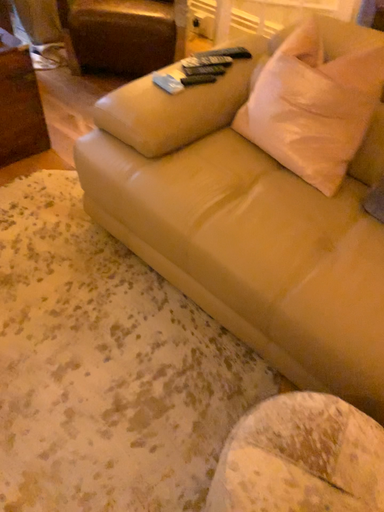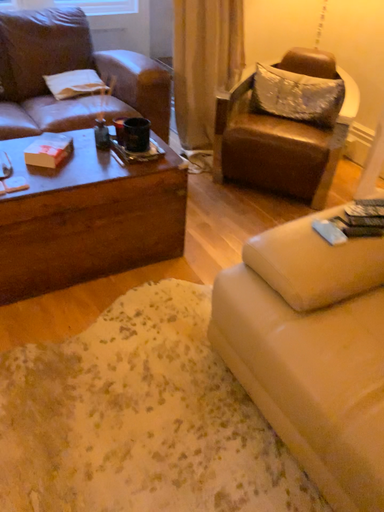
Question: How did the camera likely rotate when shooting the video?

Choices:
 (A) rotated downward
 (B) rotated upward

Answer: (B)